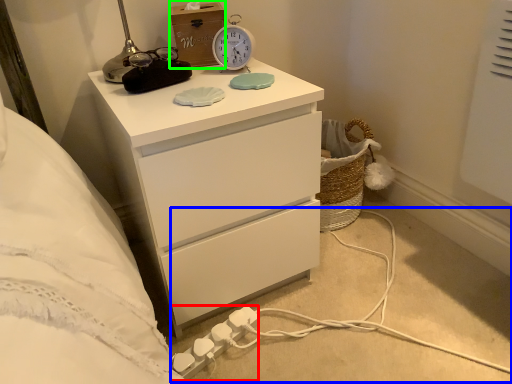
Question: Considering the real-world distances, which object is closest to extension cord (highlighted by a red box)? cable (highlighted by a blue box) or box (highlighted by a green box).

Choices:
 (A) cable
 (B) box

Answer: (A)